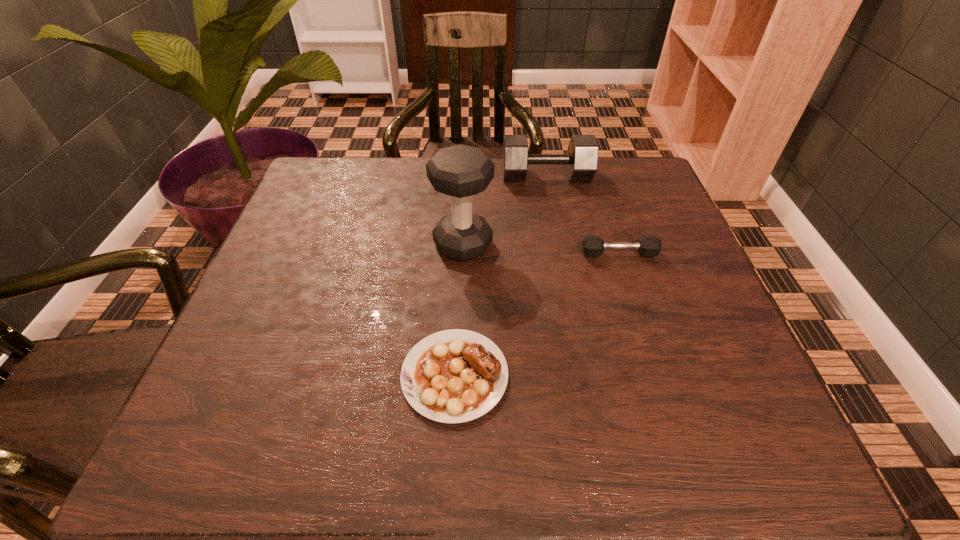
Image resolution: width=960 pixels, height=540 pixels. I want to click on free space between the steak and the leftmost dumbbell, so click(x=459, y=310).

The image size is (960, 540). I want to click on vacant area that lies between the steak and the farthest dumbbell, so click(x=500, y=275).

At what (x,y) coordinates should I click in order to perform the action: click on object that ranks as the closest to the third tallest object. Please return your answer as a coordinate pair (x, y). Looking at the image, I should click on (460, 171).

Identify which object is the third closest to the steak. Please provide its 2D coordinates. Your answer should be formatted as a tuple, i.e. [(x, y)], where the tuple contains the x and y coordinates of a point satisfying the conditions above.

[(582, 154)]

Identify which dumbbell is the second closest to the tallest dumbbell. Please provide its 2D coordinates. Your answer should be formatted as a tuple, i.e. [(x, y)], where the tuple contains the x and y coordinates of a point satisfying the conditions above.

[(592, 246)]

Locate an element on the screen. the closest dumbbell to the second shortest dumbbell is located at coordinates (460, 171).

Where is `free spot that satisfies the following two spatial constraints: 1. on the back side of the farthest object; 2. on the right side of the leftmost dumbbell`? Image resolution: width=960 pixels, height=540 pixels. free spot that satisfies the following two spatial constraints: 1. on the back side of the farthest object; 2. on the right side of the leftmost dumbbell is located at coordinates (466, 176).

At what (x,y) coordinates should I click in order to perform the action: click on vacant space that satisfies the following two spatial constraints: 1. on the back side of the shortest object; 2. on the right side of the tallest dumbbell. Please return your answer as a coordinate pair (x, y). The height and width of the screenshot is (540, 960). Looking at the image, I should click on (461, 245).

Find the location of `vacant point that satisfies the following two spatial constraints: 1. on the front side of the second shortest object; 2. on the right side of the farthest object`. vacant point that satisfies the following two spatial constraints: 1. on the front side of the second shortest object; 2. on the right side of the farthest object is located at coordinates (561, 254).